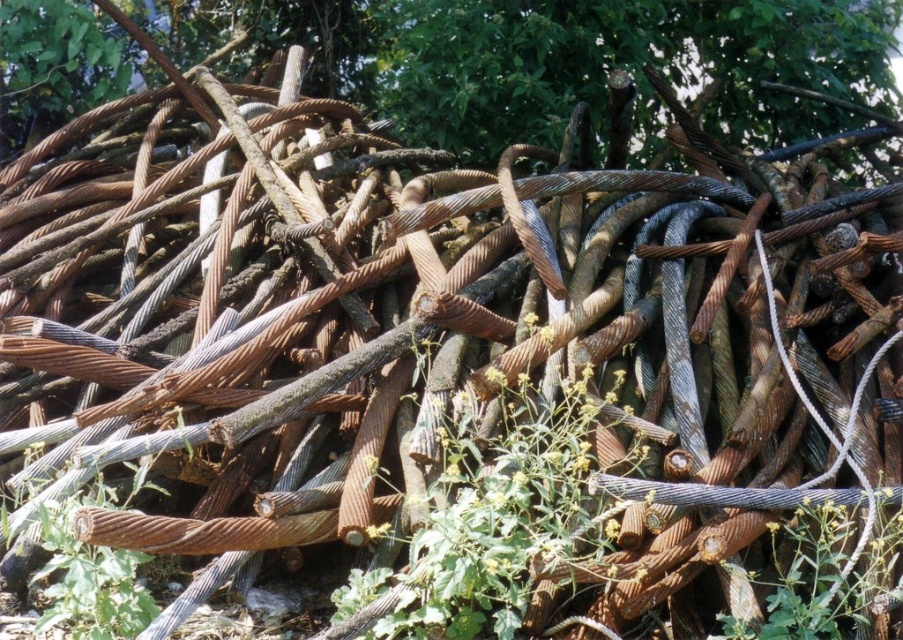
You are an environmental inspector assessing the site. You notice the brown textured wood at upper center and the green leafy weed at center. Which object is wider in this area?

The brown textured wood at upper center might be wider than the green leafy weed at center according to the description provided.

You are standing in front of the pile of rusted metal cables and want to reach the point at the bottom of the pile. Which point, point (784,49) or point (455,570), is closer to you?

Point (784,49) is further to the camera than point (455,570), so the closer point to you is point (455,570).

You are standing in front of the pile of rusted metal cables and notice a specific point at coordinates (548, 54). What object is located at that point?

The brown textured wood at upper center is located at point (548, 54).